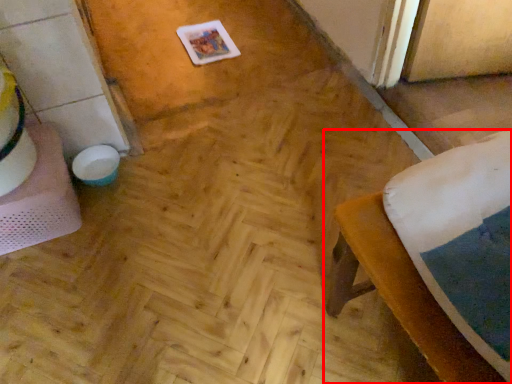
Question: From the image's perspective, where is furniture (annotated by the red box) located in relation to table in the image?

Choices:
 (A) below
 (B) above

Answer: (A)